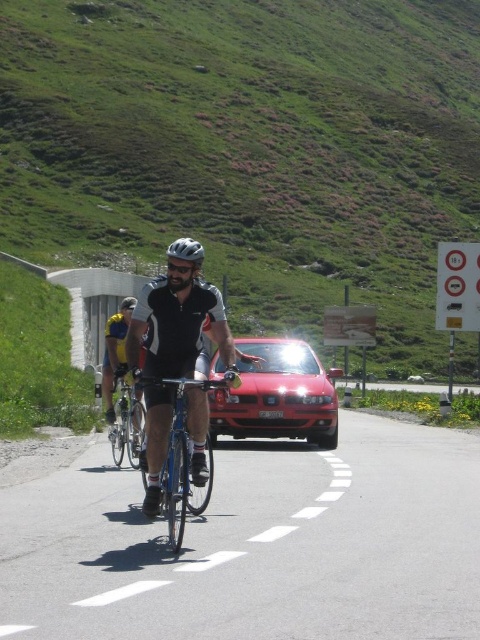
Question: Which of the following is the farthest from the observer?

Choices:
 (A) (311, 428)
 (B) (351, 452)
 (C) (479, 138)
 (D) (193, 296)

Answer: (C)

Question: Which object is positioned closest to the matte black cycling outfit at center?

Choices:
 (A) shiny red car at center
 (B) shiny blue bicycle at center
 (C) matte black helmet at center
 (D) blue metallic bicycle at center

Answer: (B)

Question: Does green grassy hillside at upper center appear on the right side of matte black helmet at center?

Choices:
 (A) yes
 (B) no

Answer: (A)

Question: Can you confirm if matte black cycling outfit at center is bigger than shiny blue bicycle at center?

Choices:
 (A) no
 (B) yes

Answer: (A)

Question: Which of the following is the closest to the observer?

Choices:
 (A) blue metallic bicycle at center
 (B) green grassy hillside at upper center
 (C) shiny blue bicycle at center

Answer: (A)

Question: Can you confirm if green grassy hillside at upper center is thinner than shiny red car at center?

Choices:
 (A) yes
 (B) no

Answer: (B)